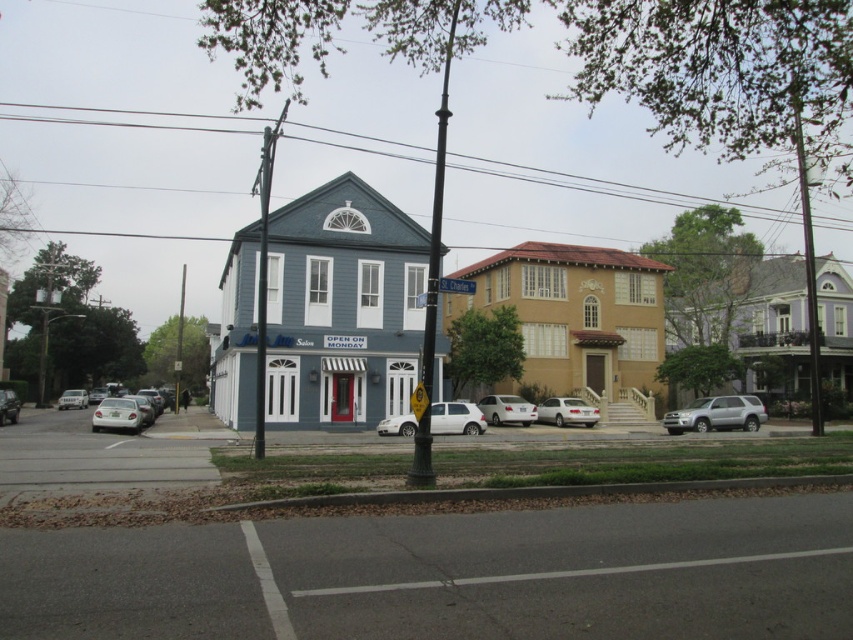
Question: Which object appears closest to the camera in this image?

Choices:
 (A) silver metallic suv at right
 (B) metallic silver sedan at lower left

Answer: (A)

Question: In this image, where is white matte car at lower left located relative to metallic silver sedan at lower left?

Choices:
 (A) right
 (B) left

Answer: (A)

Question: Does white matte car at center come in front of white matte car at lower left?

Choices:
 (A) no
 (B) yes

Answer: (B)

Question: Observing the image, what is the correct spatial positioning of white matte car at lower left in reference to white matte sedan at center?

Choices:
 (A) above
 (B) below

Answer: (A)

Question: Which object appears farthest from the camera in this image?

Choices:
 (A) silver metallic sedan at left
 (B) silver metallic suv at right
 (C) white matte car at lower left

Answer: (A)

Question: Which of the following is the farthest from the observer?

Choices:
 (A) (103, 420)
 (B) (538, 420)
 (C) (80, 394)
 (D) (397, 432)

Answer: (C)